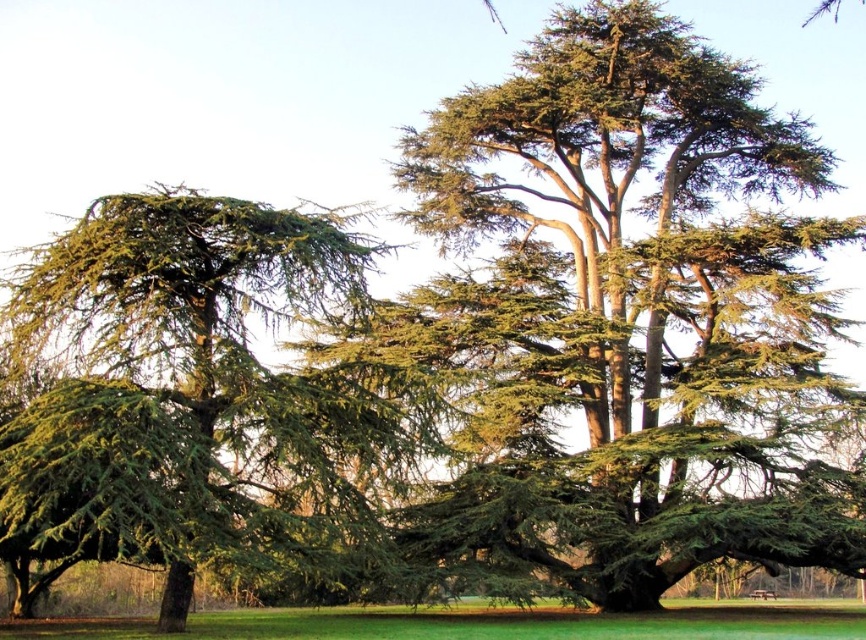
Question: Can you confirm if green needle-like foliage at center is smaller than green grass at lower center?

Choices:
 (A) no
 (B) yes

Answer: (A)

Question: Is green needle-like at left to the right of green grass at lower center from the viewer's perspective?

Choices:
 (A) no
 (B) yes

Answer: (A)

Question: Which point is closer to the camera taking this photo?

Choices:
 (A) (831, 232)
 (B) (238, 458)

Answer: (B)

Question: Estimate the real-world distances between objects in this image. Which object is closer to the green needle-like foliage at center?

Choices:
 (A) green grass at lower center
 (B) wooden park bench at center

Answer: (A)

Question: Observing the image, what is the correct spatial positioning of green needle-like foliage at center in reference to wooden park bench at center?

Choices:
 (A) above
 (B) below

Answer: (A)

Question: Which of the following is the closest to the observer?

Choices:
 (A) wooden park bench at center
 (B) green needle-like at left
 (C) green needle-like foliage at center
 (D) green grass at lower center

Answer: (B)